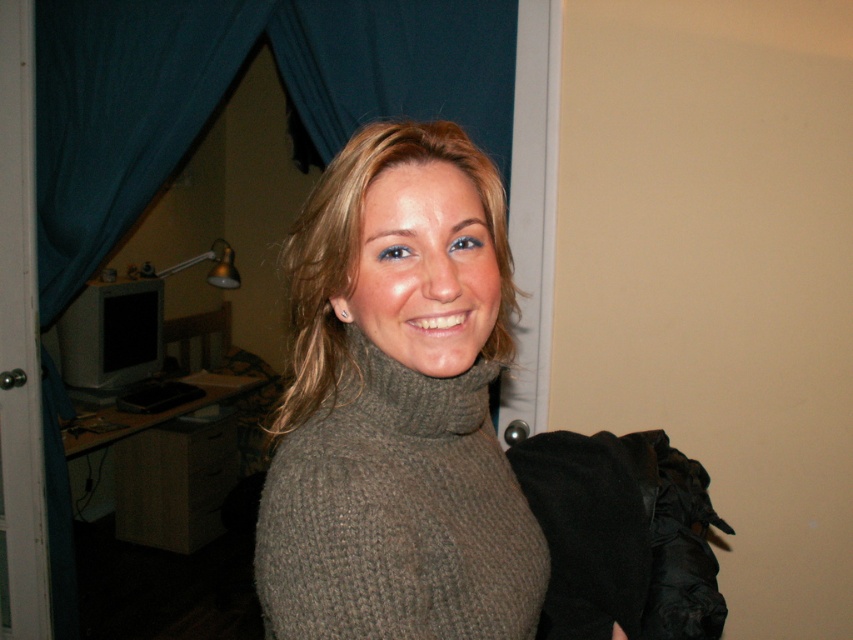
Is point (502, 308) in front of point (177, 60)?

Yes, point (502, 308) is closer to viewer.

Who is higher up, knit sweater at center or blue fabric curtain at upper left?

Positioned higher is blue fabric curtain at upper left.

Is point (303, 266) closer to viewer compared to point (119, 96)?

Yes, point (303, 266) is in front of point (119, 96).

The height and width of the screenshot is (640, 853). In order to click on knit sweater at center in this screenshot , I will do `click(397, 404)`.

Is knit sweater at center taller than knitted gray polo neck at center?

Yes.

Between knit sweater at center and knitted gray polo neck at center, which one has less height?

Standing shorter between the two is knitted gray polo neck at center.

Between point (343, 204) and point (352, 326), which one is positioned in front?

Positioned in front is point (343, 204).

The image size is (853, 640). Find the location of `knit sweater at center`. knit sweater at center is located at coordinates (397, 404).

Can you confirm if blue fabric curtain at upper left is shorter than knitted gray polo neck at center?

In fact, blue fabric curtain at upper left may be taller than knitted gray polo neck at center.

Does blue fabric curtain at upper left appear on the left side of knitted gray polo neck at center?

Indeed, blue fabric curtain at upper left is positioned on the left side of knitted gray polo neck at center.

This screenshot has height=640, width=853. What do you see at coordinates (225, 90) in the screenshot? I see `blue fabric curtain at upper left` at bounding box center [225, 90].

You are a GUI agent. You are given a task and a screenshot of the screen. Output one action in this format:
    pyautogui.click(x=<x>, y=<y>)
    Task: Click on the blue fabric curtain at upper left
    The width and height of the screenshot is (853, 640).
    Given the screenshot: What is the action you would take?
    pyautogui.click(x=225, y=90)